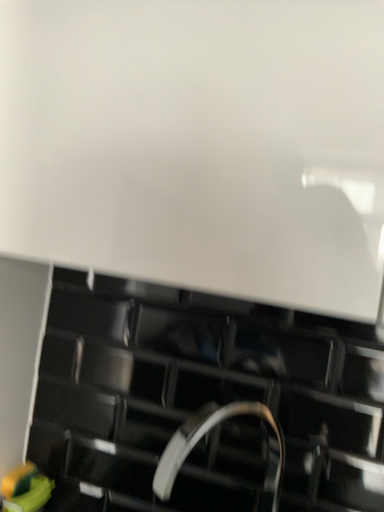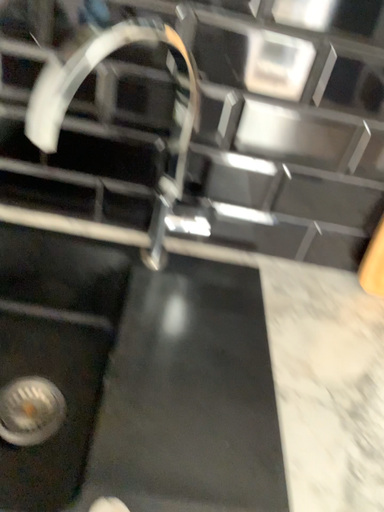
Question: How did the camera likely rotate when shooting the video?

Choices:
 (A) rotated upward
 (B) rotated downward

Answer: (B)